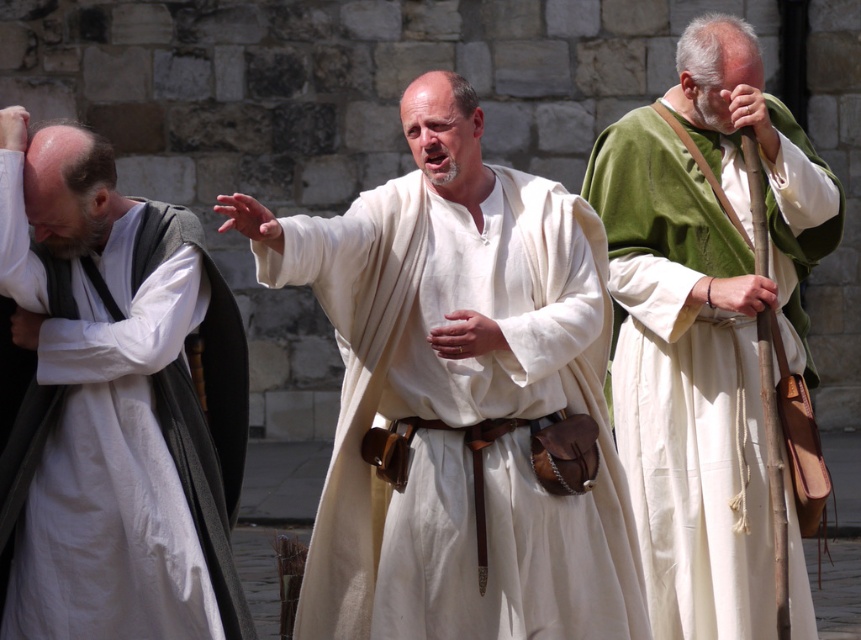
From the picture: You are a photographer standing next to a camera. You want to take a photo of the white linen robe at left. Can you fit the entire robe into the frame without moving the camera? The camera has a 50mm lens with a field of view of 46 degrees.

The white linen robe at left and camera are 34.88 meters apart. With a 50mm lens and a 46 degree field of view, the maximum distance for capturing the entire robe would be approximately 34.88 meters. Therefore, the robe can be captured in full without moving the camera.

You are an artist analyzing this historical scene. You notice the white clothed robe at center and the white linen robe at left. Which robe has a larger size according to the description?

The white clothed robe at center is bigger than the white linen robe at left.

You are an artist trying to paint the scene described. You need to place the white linen robe at left exactly at the coordinates given by point (113, 404). Can you confirm the position of the white linen robe at left based on the scene description?

The white linen robe at left is represented by point (113, 404), so you should place it at those coordinates.